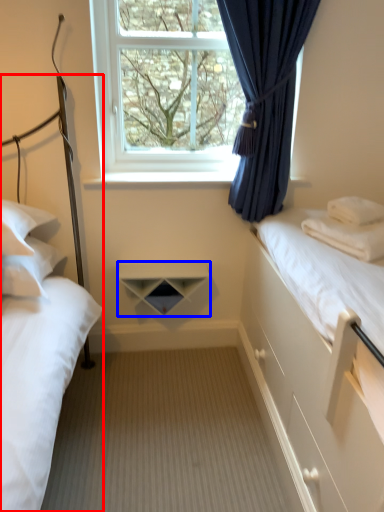
Question: Which point is further to the camera, bed (highlighted by a red box) or shelf (highlighted by a blue box)?

Choices:
 (A) bed
 (B) shelf

Answer: (B)